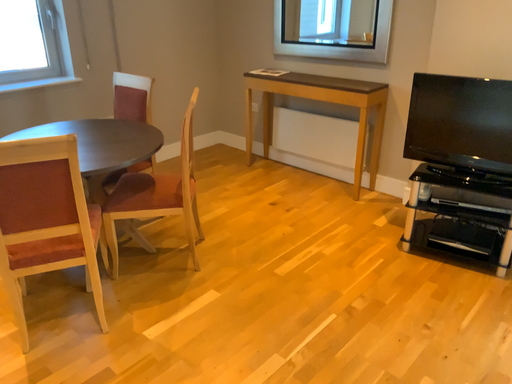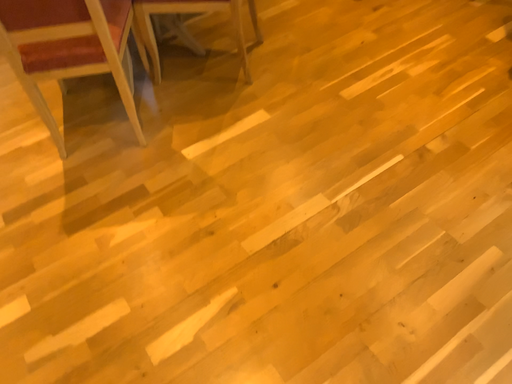
Question: Which way did the camera rotate in the video?

Choices:
 (A) rotated right
 (B) rotated left

Answer: (B)